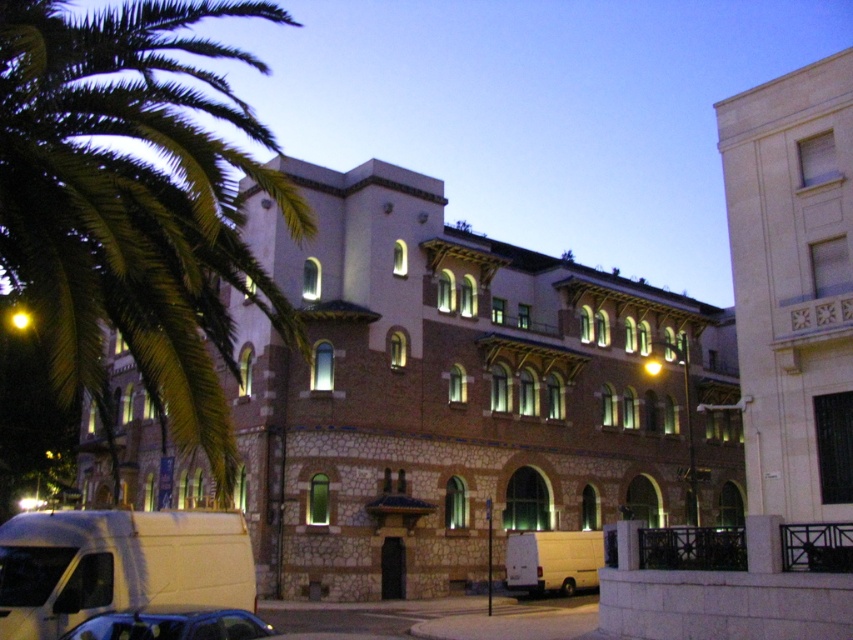
You are standing in front of the white stone building at upper right and want to walk to the white matte van at lower center. Which direction should you move relative to the building?

You should move to the left relative to the white stone building at upper right because the white matte van at lower center is located to the left of it.

You are standing in front of the building and want to know which of the two points, point (749, 172) or point (56, 577), is closer to you. Based on the image, which point is nearer?

Point (56, 577) is closer to you because it is positioned further away from the camera compared to point (749, 172), which is closer to the camera.

You are standing in front of the multi story building and want to locate the white stone building at upper right. According to the coordinates given, where would you look to find it?

The white stone building at upper right is located at the 2D coordinates point (x=793, y=300).